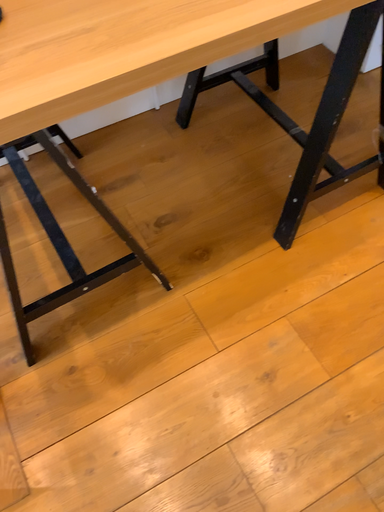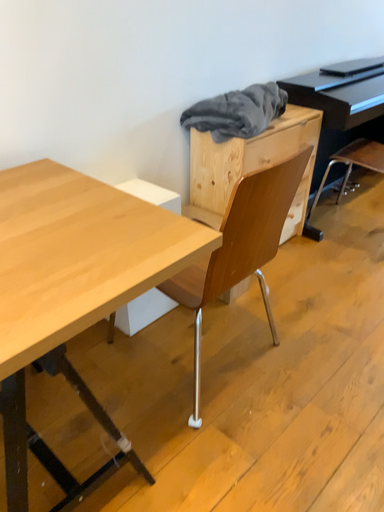
Question: Which way did the camera rotate in the video?

Choices:
 (A) rotated upward
 (B) rotated downward

Answer: (A)